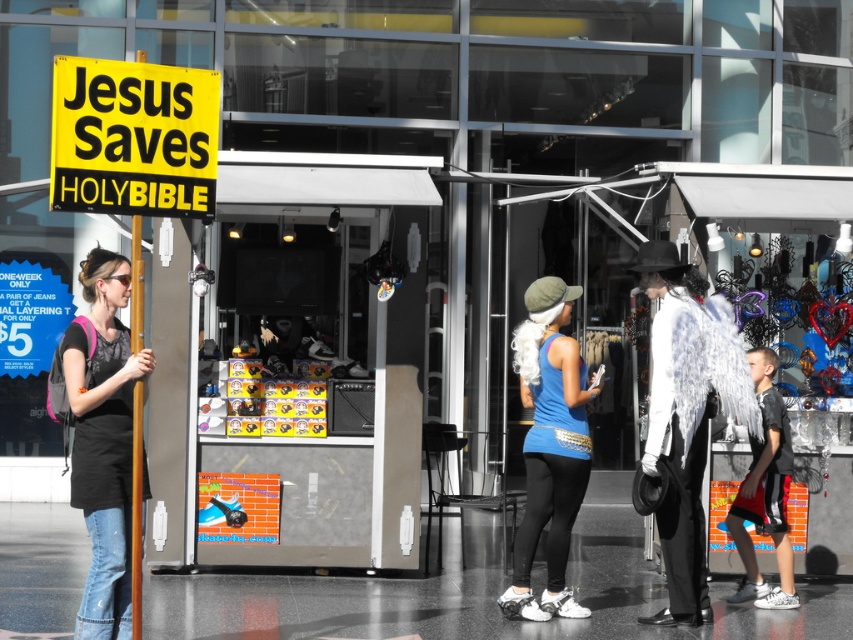
Question: Based on their relative distances, which object is nearer to the black mesh shirt at right?

Choices:
 (A) wooden pole at left
 (B) blue fabric tank top at center
 (C) matte black t-shirt at left

Answer: (B)

Question: Is blue fabric tank top at center below black mesh shirt at right?

Choices:
 (A) yes
 (B) no

Answer: (B)

Question: Is blue fabric tank top at center to the right of black mesh shirt at right from the viewer's perspective?

Choices:
 (A) no
 (B) yes

Answer: (A)

Question: Which of the following is the closest to the observer?

Choices:
 (A) blue fabric tank top at center
 (B) wooden pole at left
 (C) yellow paper sign at upper left

Answer: (C)

Question: Where is matte black t-shirt at left located in relation to black mesh shirt at right in the image?

Choices:
 (A) below
 (B) above

Answer: (B)

Question: Which point is closer to the camera?

Choices:
 (A) (74, 323)
 (B) (141, 392)
 (C) (525, 611)
 (D) (125, 108)

Answer: (D)